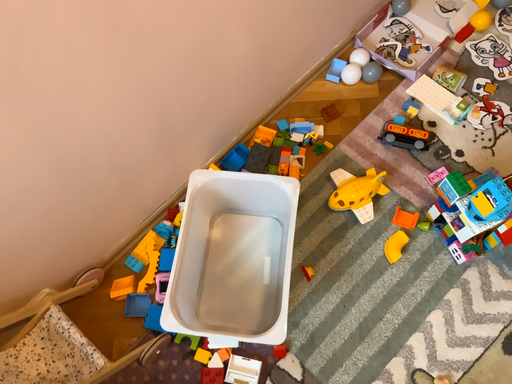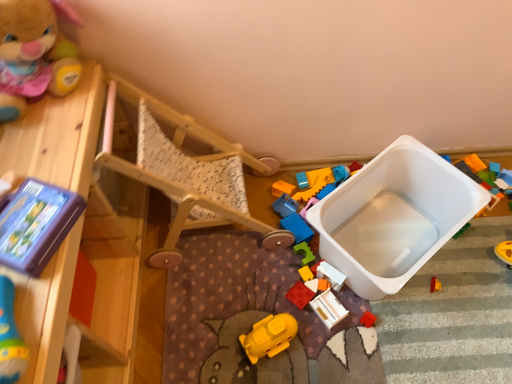
Question: Which way did the camera rotate in the video?

Choices:
 (A) rotated left
 (B) rotated right

Answer: (A)